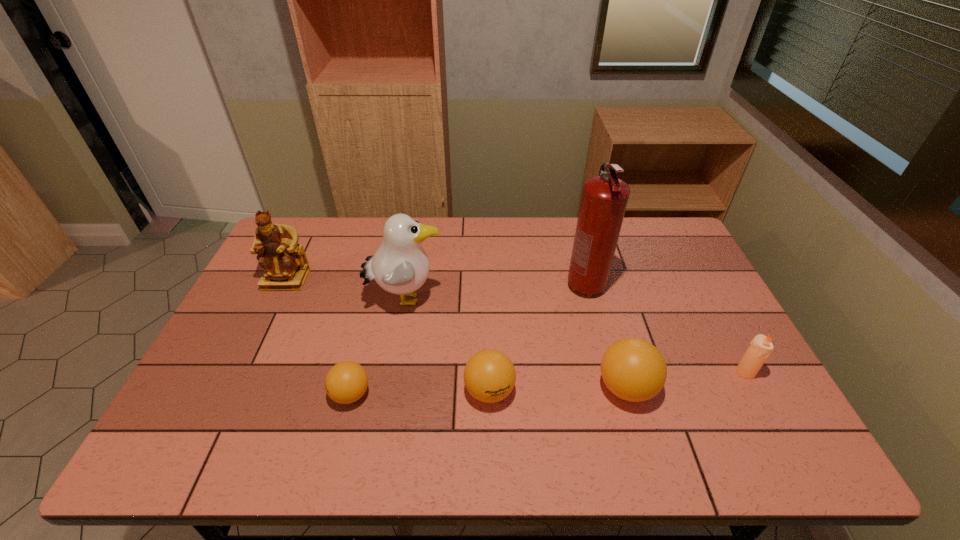
Locate an element on the screen. The image size is (960, 540). vacant space that's between the gull and the tallest ping-pong ball is located at coordinates (516, 343).

Identify the location of free area in between the second ping-pong ball from right to left and the sixth shortest object. The height and width of the screenshot is (540, 960). (447, 345).

The height and width of the screenshot is (540, 960). Identify the location of vacant space that's between the tallest object and the shortest ping-pong ball. (468, 340).

Locate an element on the screen. The image size is (960, 540). unoccupied area between the sixth tallest object and the rightmost ping-pong ball is located at coordinates (558, 389).

Where is `unoccupied area between the leftmost object and the tallest object`? This screenshot has height=540, width=960. unoccupied area between the leftmost object and the tallest object is located at coordinates (436, 282).

The height and width of the screenshot is (540, 960). In order to click on object that can be found as the second closest to the gull in this screenshot , I will do `click(346, 382)`.

Point out which object is positioned as the fifth nearest to the fourth object from left to right. Please provide its 2D coordinates. Your answer should be formatted as a tuple, i.e. [(x, y)], where the tuple contains the x and y coordinates of a point satisfying the conditions above.

[(760, 348)]

Identify which ping-pong ball is the second nearest to the tallest ping-pong ball. Please provide its 2D coordinates. Your answer should be formatted as a tuple, i.e. [(x, y)], where the tuple contains the x and y coordinates of a point satisfying the conditions above.

[(346, 382)]

Identify which ping-pong ball is the nearest to the third tallest object. Please provide its 2D coordinates. Your answer should be formatted as a tuple, i.e. [(x, y)], where the tuple contains the x and y coordinates of a point satisfying the conditions above.

[(346, 382)]

Locate an element on the screen. Image resolution: width=960 pixels, height=540 pixels. free point that satisfies the following two spatial constraints: 1. on the beak of the candle; 2. on the right side of the gull is located at coordinates (392, 372).